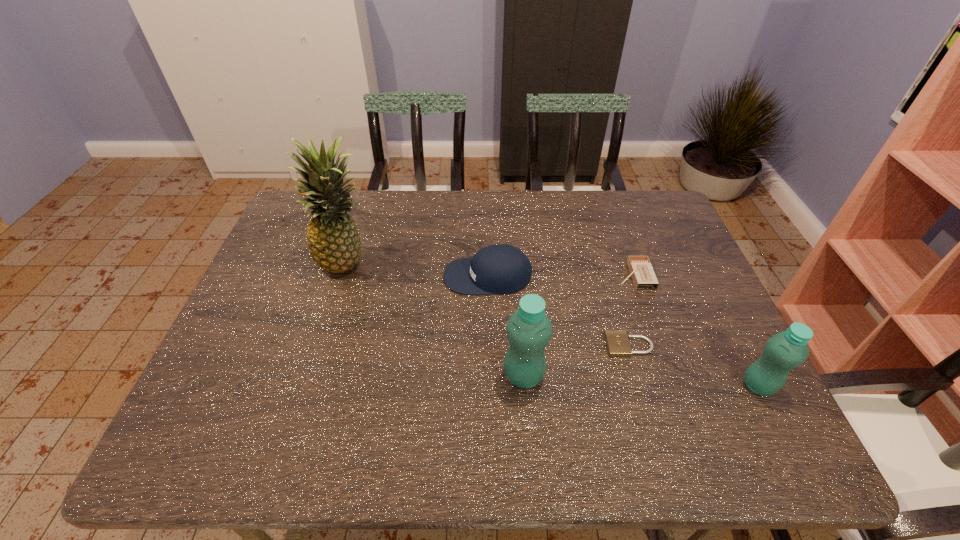
Select which object is the closest to the tallest object. Please provide its 2D coordinates. Your answer should be formatted as a tuple, i.e. [(x, y)], where the tuple contains the x and y coordinates of a point satisfying the conditions above.

[(503, 269)]

Identify the location of vacant space that satisfies the following two spatial constraints: 1. on the front side of the fourth farthest object; 2. at the front cap of the left water bottle. (638, 376).

Find the location of a particular element. blank space that satisfies the following two spatial constraints: 1. on the front side of the leftmost object; 2. on the left side of the padlock is located at coordinates (322, 346).